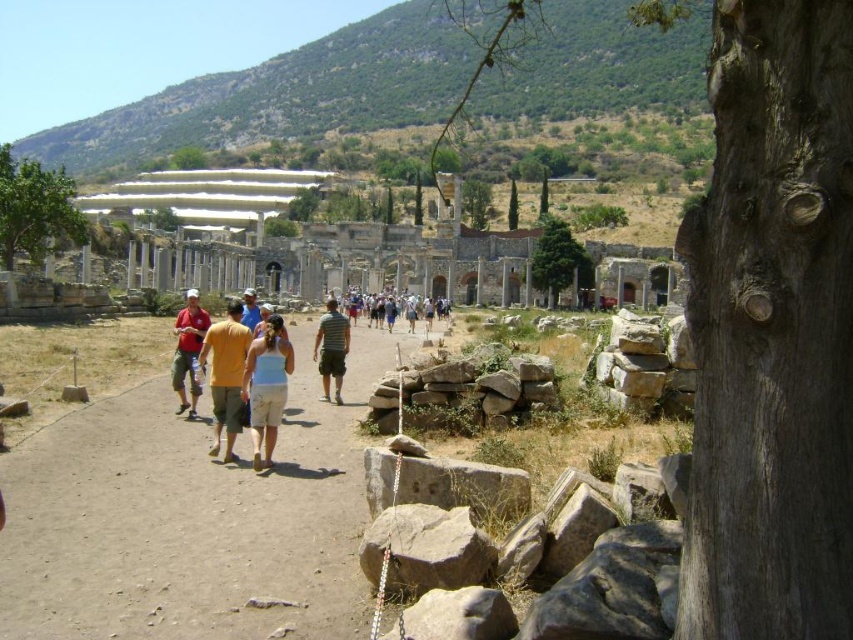
You are standing at the archaeological site and want to take a photo of both the point at coordinates (x=364, y=364) and the point at coordinates (x=228, y=417). Which point should you focus on first to ensure both are in sharp focus?

You should focus on the point at coordinates (x=364, y=364) first because it is closer to the camera than the point at coordinates (x=228, y=417). This ensures both points will be in focus as the point at (x=364, y=364) is nearer and the other is further away.